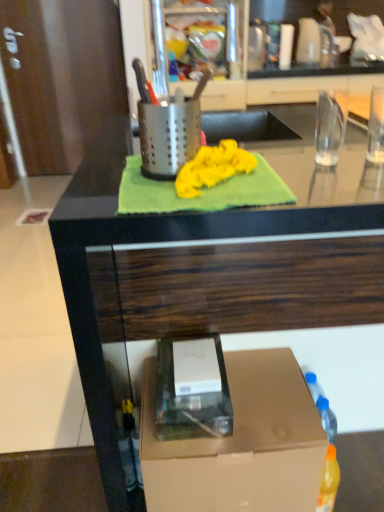
Locate an element on the screen. brown cardboard box at lower right is located at coordinates (238, 443).

What do you see at coordinates (215, 259) in the screenshot? I see `green fabric at upper center` at bounding box center [215, 259].

Measure the distance between yellow fabric at center and camera.

yellow fabric at center and camera are 28.62 inches apart from each other.

Locate an element on the screen. brown cardboard box at lower right is located at coordinates (238, 443).

Between yellow fabric at center and brown cardboard box at lower right, which one has smaller width?

Thinner between the two is yellow fabric at center.

Is yellow fabric at center to the left of brown cardboard box at lower right from the viewer's perspective?

Correct, you'll find yellow fabric at center to the left of brown cardboard box at lower right.

Consider the image. From a real-world perspective, is yellow fabric at center below brown cardboard box at lower right?

Incorrect, from a real-world perspective, yellow fabric at center is higher than brown cardboard box at lower right.

Which is in front, point (192, 184) or point (308, 500)?

Point (192, 184)

Where is `box on the right of the yellow fabric at center`? Image resolution: width=384 pixels, height=512 pixels. box on the right of the yellow fabric at center is located at coordinates (238, 443).

Between point (183, 454) and point (137, 191), which one is positioned behind?

The point (183, 454) is more distant.

Is brown cardboard box at lower right directly adjacent to yellow fabric at center?

No, brown cardboard box at lower right is not beside yellow fabric at center.

From a real-world perspective, between yellow fabric at center and brown cardboard box at lower right, who is vertically higher?

yellow fabric at center is physically above.

Which object is positioned more to the left, yellow fabric at center or brown cardboard box at lower right?

Positioned to the left is yellow fabric at center.

You are a GUI agent. You are given a task and a screenshot of the screen. Output one action in this format:
    pyautogui.click(x=<x>, y=<y>)
    Task: Click on the box below the yellow fabric at center (from a real-world perspective)
    This screenshot has height=512, width=384.
    Given the screenshot: What is the action you would take?
    pyautogui.click(x=238, y=443)

Is the surface of yellow fabric at center in direct contact with brown cardboard box at lower right?

yellow fabric at center and brown cardboard box at lower right are clearly separated.

What's the angular difference between yellow fabric at center and green fabric at upper center's facing directions?

The angle between the facing direction of yellow fabric at center and the facing direction of green fabric at upper center is 90.9 degrees.

I want to click on countertop beneath the yellow fabric at center (from a real-world perspective), so click(x=215, y=259).

Which is nearer, (193, 207) or (345, 205)?

Point (193, 207)

From a real-world perspective, which object rests below the other?

In real-world perspective, green fabric at upper center is lower.

Is yellow fabric at center outside of yellow fabric at center?

Actually, yellow fabric at center is at least partially inside yellow fabric at center.

From a real-world perspective, is yellow fabric at center physically above yellow fabric at center?

Correct, in the physical world, yellow fabric at center is higher than yellow fabric at center.

What's the angular difference between yellow fabric at center and yellow fabric at center's facing directions?

The angular difference between yellow fabric at center and yellow fabric at center is 0.000864 degrees.

Is yellow fabric at center positioned in front of yellow fabric at center?

No, the depth of yellow fabric at center is greater than that of yellow fabric at center.

Can you confirm if green fabric at upper center is smaller than yellow fabric at center?

Actually, green fabric at upper center might be larger than yellow fabric at center.

Can yellow fabric at center be found inside green fabric at upper center?

Yes, green fabric at upper center is surrounding yellow fabric at center.

Considering the relative positions of green fabric at upper center and yellow fabric at center in the image provided, is green fabric at upper center to the left of yellow fabric at center from the viewer's perspective?

In fact, green fabric at upper center is to the right of yellow fabric at center.

Between yellow fabric at center and green fabric at upper center, which one has smaller width?

With smaller width is yellow fabric at center.

Is yellow fabric at center at the right side of green fabric at upper center?

No, yellow fabric at center is not to the right of green fabric at upper center.

Who is smaller, yellow fabric at center or green fabric at upper center?

yellow fabric at center is smaller.

From a real-world perspective, between yellow fabric at center and green fabric at upper center, who is vertically lower?

green fabric at upper center is physically lower.

Find the location of a particular element. The width and height of the screenshot is (384, 512). cloth above the brown cardboard box at lower right (from the image's perspective) is located at coordinates (213, 167).

Find the location of `box on the right of yellow fabric at center`. box on the right of yellow fabric at center is located at coordinates (238, 443).

Based on their spatial positions, is brown cardboard box at lower right or green fabric at upper center further from yellow fabric at center?

brown cardboard box at lower right is positioned further to the anchor yellow fabric at center.

When comparing their distances from yellow fabric at center, does yellow fabric at center or green fabric at upper center seem closer?

Among the two, yellow fabric at center is located nearer to yellow fabric at center.

Which object lies further to the anchor point brown cardboard box at lower right, green fabric at upper center or yellow fabric at center?

Among the two, yellow fabric at center is located further to brown cardboard box at lower right.

Which object lies nearer to the anchor point brown cardboard box at lower right, green fabric at upper center or yellow fabric at center?

green fabric at upper center is positioned closer to the anchor brown cardboard box at lower right.

Based on their spatial positions, is brown cardboard box at lower right or green fabric at upper center further from yellow fabric at center?

Based on the image, brown cardboard box at lower right appears to be further to yellow fabric at center.

Based on their spatial positions, is yellow fabric at center or yellow fabric at center further from brown cardboard box at lower right?

yellow fabric at center.

When comparing their distances from green fabric at upper center, does yellow fabric at center or yellow fabric at center seem closer?

Based on the image, yellow fabric at center appears to be nearer to green fabric at upper center.

When comparing their distances from brown cardboard box at lower right, does yellow fabric at center or green fabric at upper center seem closer?

Based on the image, green fabric at upper center appears to be nearer to brown cardboard box at lower right.

You are a GUI agent. You are given a task and a screenshot of the screen. Output one action in this format:
    pyautogui.click(x=<x>, y=<y>)
    Task: Click on the cloth located between yellow fabric at center and green fabric at upper center in the left-right direction
    This screenshot has width=384, height=512.
    Given the screenshot: What is the action you would take?
    pyautogui.click(x=213, y=167)

Where is `countertop between yellow fabric at center and brown cardboard box at lower right from top to bottom`? The width and height of the screenshot is (384, 512). countertop between yellow fabric at center and brown cardboard box at lower right from top to bottom is located at coordinates (215, 259).

Locate an element on the screen. Image resolution: width=384 pixels, height=512 pixels. bath towel between yellow fabric at center and brown cardboard box at lower right in the vertical direction is located at coordinates (202, 191).

This screenshot has height=512, width=384. I want to click on countertop between yellow fabric at center and brown cardboard box at lower right vertically, so click(x=215, y=259).